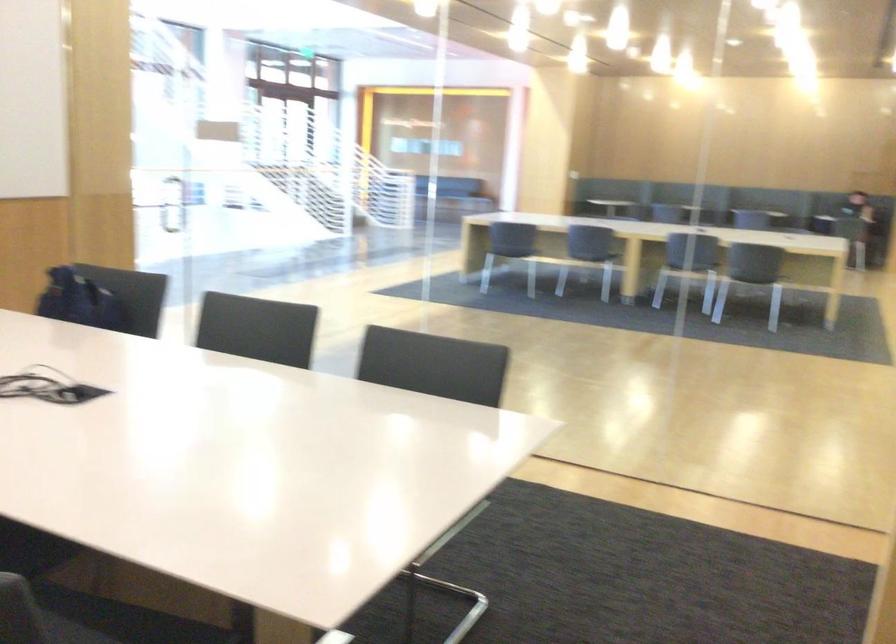
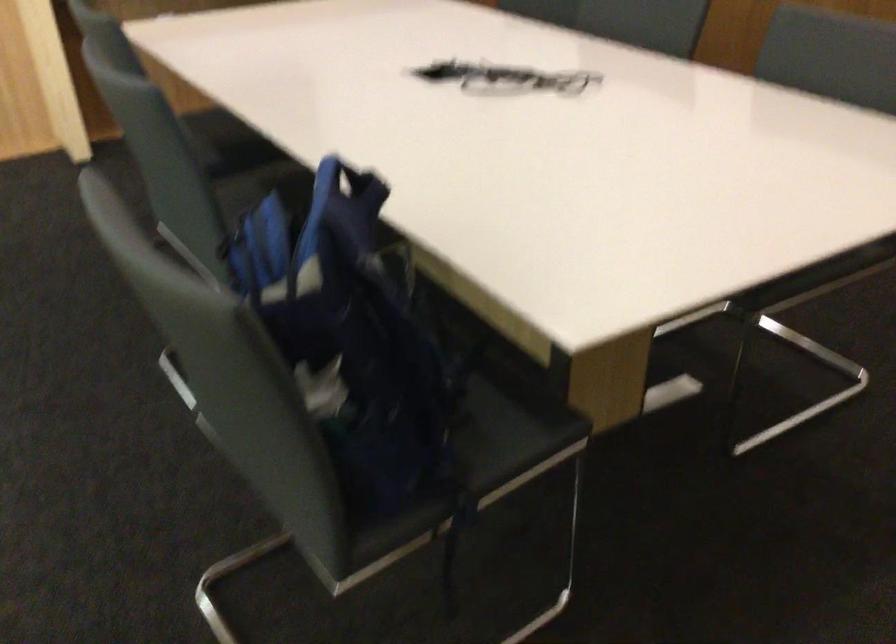
Where in the second image is the point corresponding to [71,274] from the first image?

(349, 184)